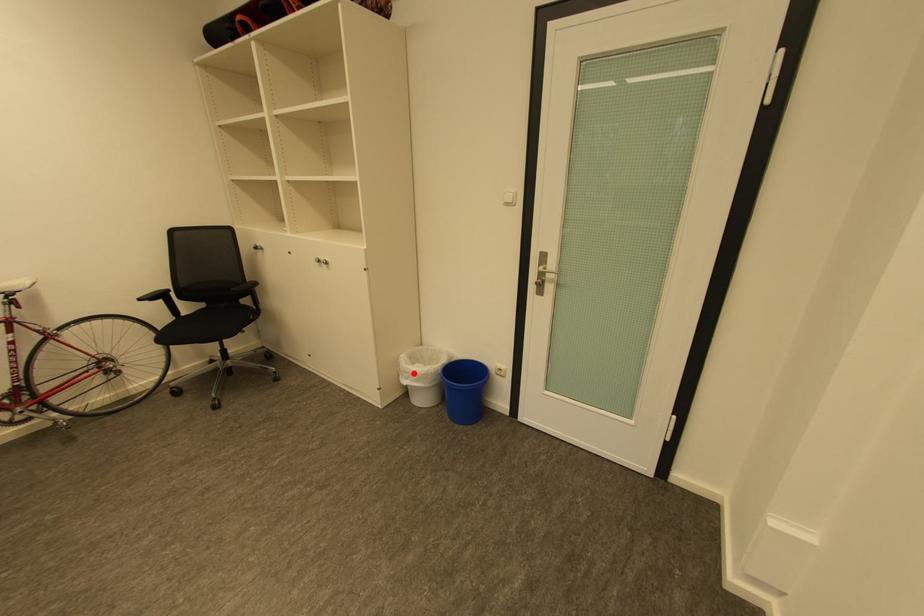
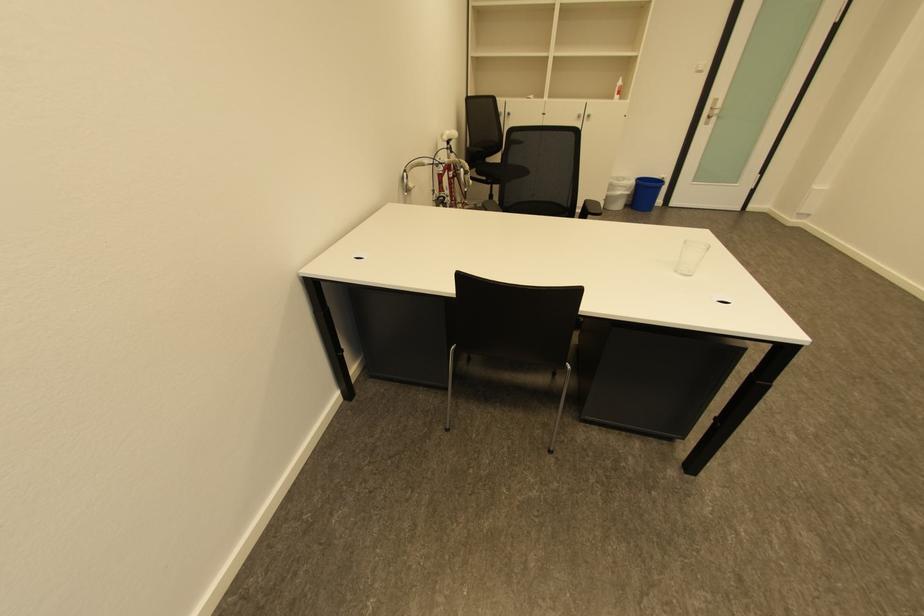
Question: I am providing you with two images of the same scene from different viewpoints. A red point is shown in image1. For the corresponding object point in image2, is it positioned nearer or farther from the camera?

Choices:
 (A) Nearer
 (B) Farther

Answer: (A)